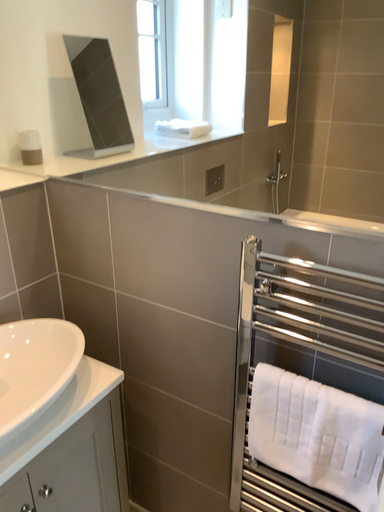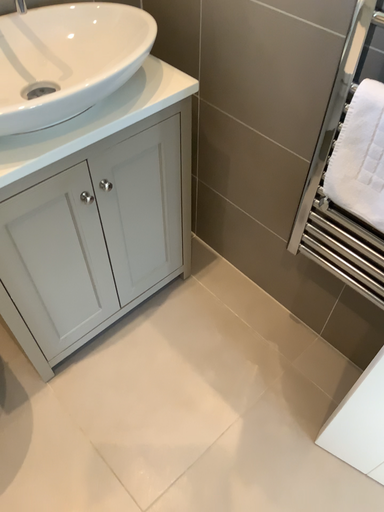
Question: Which way did the camera rotate in the video?

Choices:
 (A) rotated left
 (B) rotated right

Answer: (A)